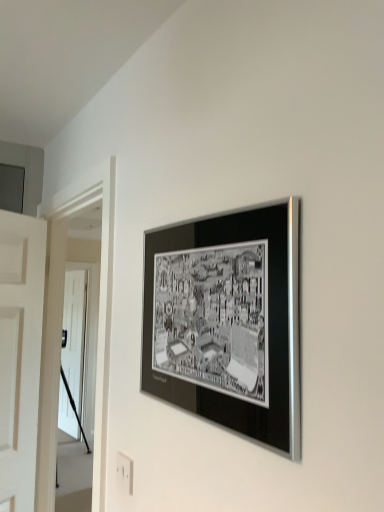
What is the approximate height of white glossy door at left?

The height of white glossy door at left is 1.89 meters.

What is the approximate height of black metallic frame at upper center?

The height of black metallic frame at upper center is 16.91 inches.

At what (x,y) coordinates should I click in order to perform the action: click on white glossy door at left. Please return your answer as a coordinate pair (x, y). Looking at the image, I should click on (73, 351).

Considering the sizes of objects white glossy door at left and black metallic frame at upper center in the image provided, who is wider, white glossy door at left or black metallic frame at upper center?

black metallic frame at upper center.

In terms of height, does white glossy door at left look taller or shorter compared to black metallic frame at upper center?

In the image, white glossy door at left appears to be taller than black metallic frame at upper center.

From the image's perspective, does white glossy door at left appear lower than black metallic frame at upper center?

Indeed, from the image's perspective, white glossy door at left is shown beneath black metallic frame at upper center.

Where is `picture frame lying above the white glossy door at left (from the image's perspective)`? This screenshot has height=512, width=384. picture frame lying above the white glossy door at left (from the image's perspective) is located at coordinates (227, 321).

Which object is positioned more to the right, white glossy door at left or white plastic electric outlet at lower center?

Positioned to the right is white plastic electric outlet at lower center.

From a real-world perspective, which is physically above, white glossy door at left or white plastic electric outlet at lower center?

white plastic electric outlet at lower center, from a real-world perspective.

Which object is further away from the camera, black metallic frame at upper center or white glossy door at left?

white glossy door at left is further from the camera.

Is black metallic frame at upper center positioned with its back to white glossy door at left?

No, black metallic frame at upper center's orientation is not away from white glossy door at left.

Considering the relative positions of black metallic frame at upper center and white glossy door at left in the image provided, is black metallic frame at upper center to the right of white glossy door at left from the viewer's perspective?

Yes, black metallic frame at upper center is to the right of white glossy door at left.

From the image's perspective, which is below, black metallic frame at upper center or white glossy door at left?

white glossy door at left, from the image's perspective.

Is white plastic electric outlet at lower center aimed at black metallic frame at upper center?

No, white plastic electric outlet at lower center is not aimed at black metallic frame at upper center.

Find the location of `picture frame above the white plastic electric outlet at lower center (from the image's perspective)`. picture frame above the white plastic electric outlet at lower center (from the image's perspective) is located at coordinates (227, 321).

Is white plastic electric outlet at lower center inside or outside of black metallic frame at upper center?

white plastic electric outlet at lower center is not enclosed by black metallic frame at upper center.

Considering the relative sizes of white plastic electric outlet at lower center and black metallic frame at upper center in the image provided, is white plastic electric outlet at lower center shorter than black metallic frame at upper center?

Correct, white plastic electric outlet at lower center is not as tall as black metallic frame at upper center.

Could you tell me if white plastic electric outlet at lower center is facing white glossy door at left?

No, white plastic electric outlet at lower center is not facing towards white glossy door at left.

Between white plastic electric outlet at lower center and white glossy door at left, which one appears on the right side from the viewer's perspective?

Positioned to the right is white plastic electric outlet at lower center.

From a real-world perspective, relative to white glossy door at left, is white plastic electric outlet at lower center vertically above or below?

white plastic electric outlet at lower center is situated higher than white glossy door at left in the real world.

Is point (132, 492) positioned in front of point (85, 285)?

That is True.

Which object is positioned more to the left, black metallic frame at upper center or white plastic electric outlet at lower center?

From the viewer's perspective, white plastic electric outlet at lower center appears more on the left side.

Is black metallic frame at upper center next to white plastic electric outlet at lower center and touching it?

black metallic frame at upper center and white plastic electric outlet at lower center are clearly separated.

Is black metallic frame at upper center completely or partially outside of white plastic electric outlet at lower center?

Indeed, black metallic frame at upper center is completely outside white plastic electric outlet at lower center.

Does black metallic frame at upper center have a lesser height compared to white plastic electric outlet at lower center?

Incorrect, the height of black metallic frame at upper center does not fall short of that of white plastic electric outlet at lower center.

Locate an element on the screen. The width and height of the screenshot is (384, 512). picture frame to the right of white glossy door at left is located at coordinates (227, 321).

This screenshot has width=384, height=512. Identify the location of door located below the white plastic electric outlet at lower center (from the image's perspective). (73, 351).

When comparing their distances from white glossy door at left, does white plastic electric outlet at lower center or black metallic frame at upper center seem further?

black metallic frame at upper center is further to white glossy door at left.

Looking at the image, which one is located closer to white plastic electric outlet at lower center, white glossy door at left or black metallic frame at upper center?

black metallic frame at upper center lies closer to white plastic electric outlet at lower center than the other object.

When comparing their distances from black metallic frame at upper center, does white glossy door at left or white plastic electric outlet at lower center seem further?

white glossy door at left.

Estimate the real-world distances between objects in this image. Which object is closer to white glossy door at left, black metallic frame at upper center or white plastic electric outlet at lower center?

white plastic electric outlet at lower center is closer to white glossy door at left.

Based on their spatial positions, is black metallic frame at upper center or white glossy door at left closer to white plastic electric outlet at lower center?

black metallic frame at upper center is positioned closer to the anchor white plastic electric outlet at lower center.

Which object lies nearer to the anchor point black metallic frame at upper center, white plastic electric outlet at lower center or white glossy door at left?

The object closer to black metallic frame at upper center is white plastic electric outlet at lower center.

At what (x,y) coordinates should I click in order to perform the action: click on electric outlet located between black metallic frame at upper center and white glossy door at left in the depth direction. Please return your answer as a coordinate pair (x, y). The image size is (384, 512). Looking at the image, I should click on (124, 474).